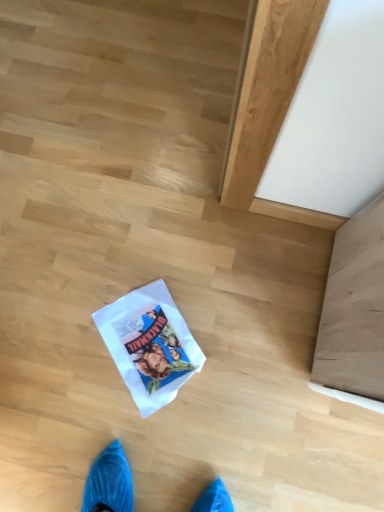
Find the location of a particular element. Image resolution: width=384 pixels, height=512 pixels. free space to the back side of white paper comic book at center is located at coordinates (155, 256).